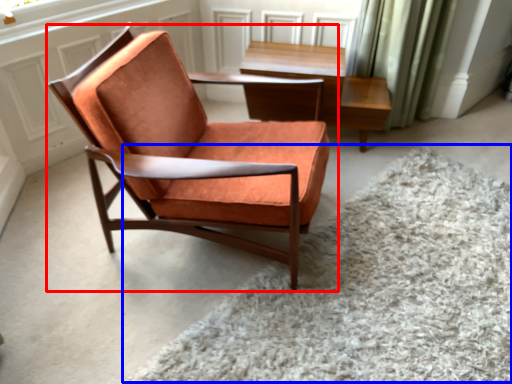
Question: Which point is further to the camera, chair (highlighted by a red box) or plain (highlighted by a blue box)?

Choices:
 (A) chair
 (B) plain

Answer: (A)